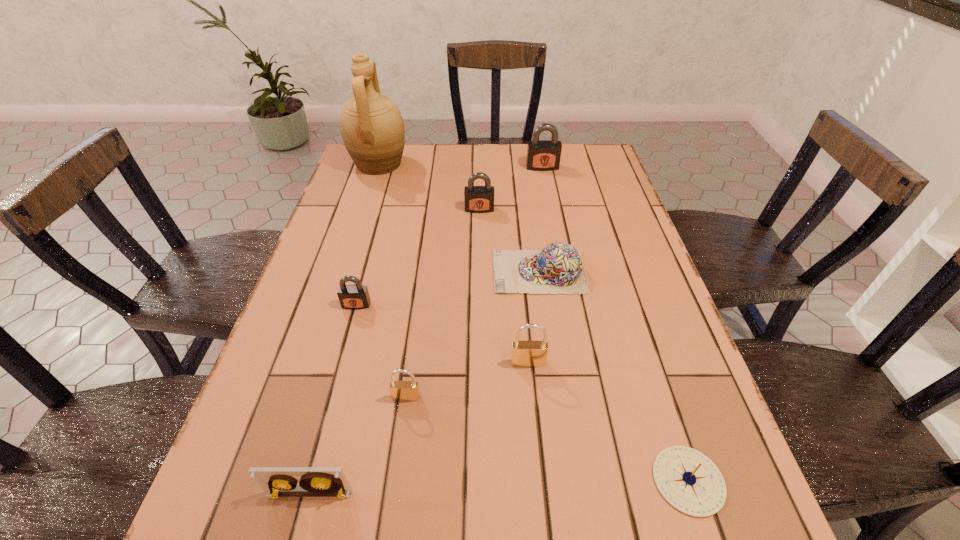
Find the location of a particular element. videotape that is at the left edge is located at coordinates (276, 481).

Find the location of a particular element. The height and width of the screenshot is (540, 960). object that is at the right edge is located at coordinates (688, 480).

Find the location of a particular element. object located in the far left corner section of the desktop is located at coordinates (372, 128).

Where is `free space at the far edge of the desktop`? This screenshot has height=540, width=960. free space at the far edge of the desktop is located at coordinates (489, 158).

Where is `vacant space at the left edge`? The height and width of the screenshot is (540, 960). vacant space at the left edge is located at coordinates (345, 247).

The image size is (960, 540). What are the coordinates of `free region at the right edge of the desktop` in the screenshot? It's located at (612, 338).

This screenshot has width=960, height=540. In order to click on vacant space at the far left corner in this screenshot , I will do `click(368, 181)`.

Where is `vacant space that is in between the shortest object and the videotape`? The height and width of the screenshot is (540, 960). vacant space that is in between the shortest object and the videotape is located at coordinates (499, 487).

I want to click on vacant area that lies between the brown videotape and the leftmost padlock, so click(333, 399).

Locate an element on the screen. This screenshot has height=540, width=960. blank region between the second smallest gray padlock and the shortest object is located at coordinates (584, 345).